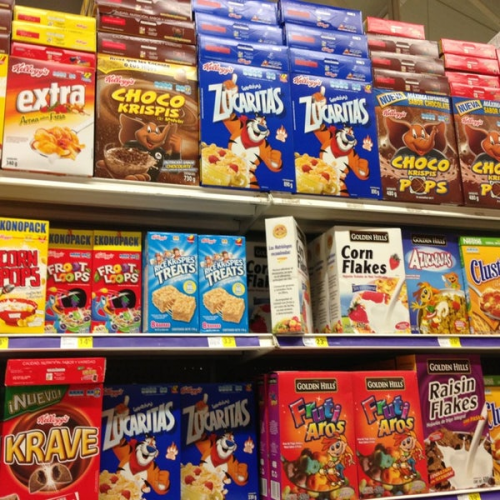
Where is `price labels on shelves`? The width and height of the screenshot is (500, 500). price labels on shelves is located at coordinates tap(71, 340), tap(218, 342), tap(314, 338), tap(455, 341).